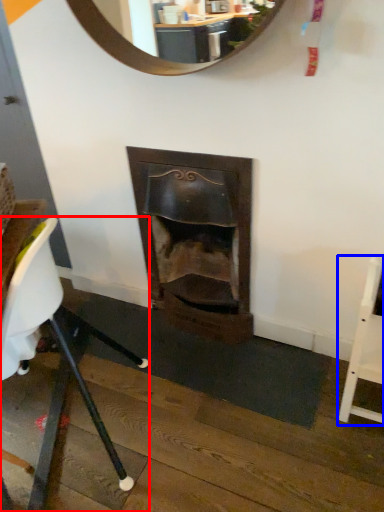
Question: Which object appears closest to the camera in this image, chair (highlighted by a red box) or chair (highlighted by a blue box)?

Choices:
 (A) chair
 (B) chair

Answer: (A)